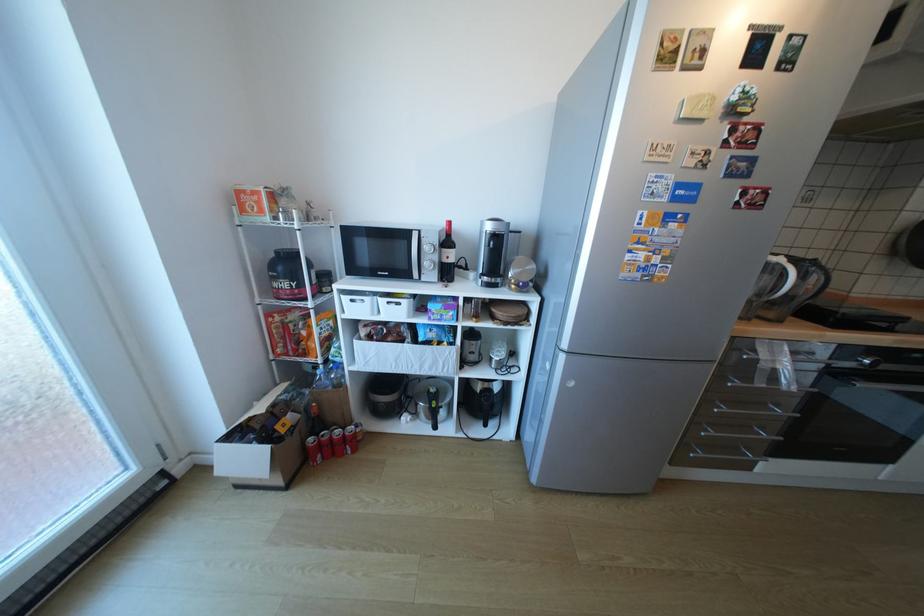
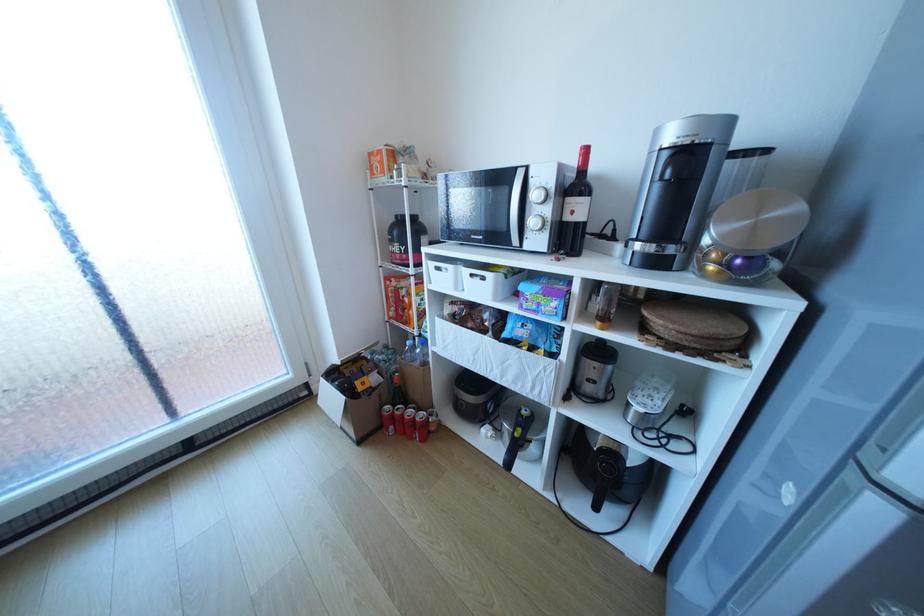
Locate, in the second image, the point that corresponds to (x=397, y=302) in the first image.

(481, 275)